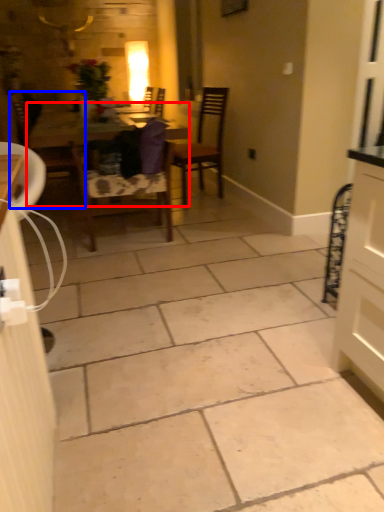
Question: Which of the following is the farthest to the observer, table (highlighted by a red box) or chair (highlighted by a blue box)?

Choices:
 (A) table
 (B) chair

Answer: (B)